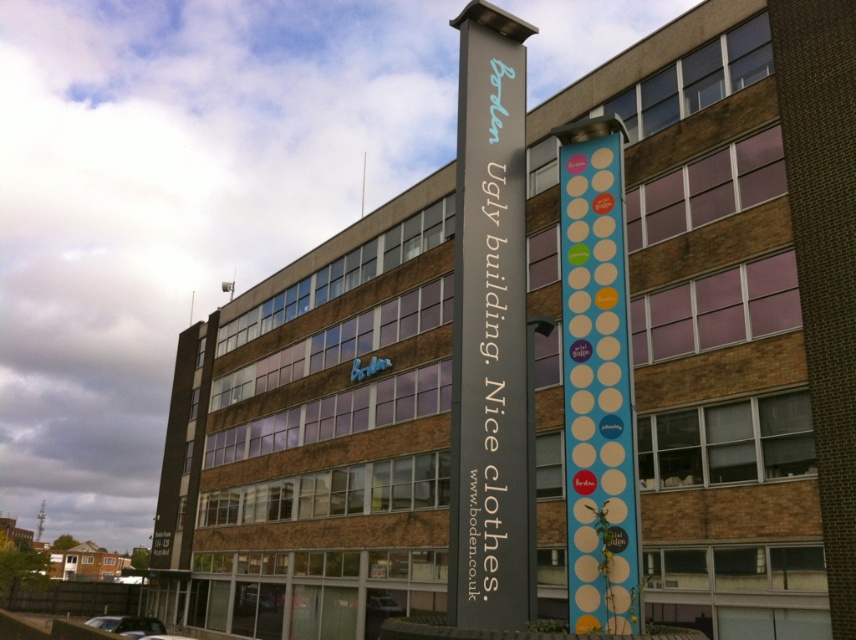
You are standing in front of the building and want to read both the dark gray signpost at center and the blue polka dot sign at center. Which one is closer to you?

The dark gray signpost at center is closer to you than the blue polka dot sign at center, which is behind it.

You are standing in front of the building and want to read both the dark gray signpost at center and the blue polka dot sign at center. Which one is located lower?

The dark gray signpost at center is positioned under the blue polka dot sign at center, so it is located lower.